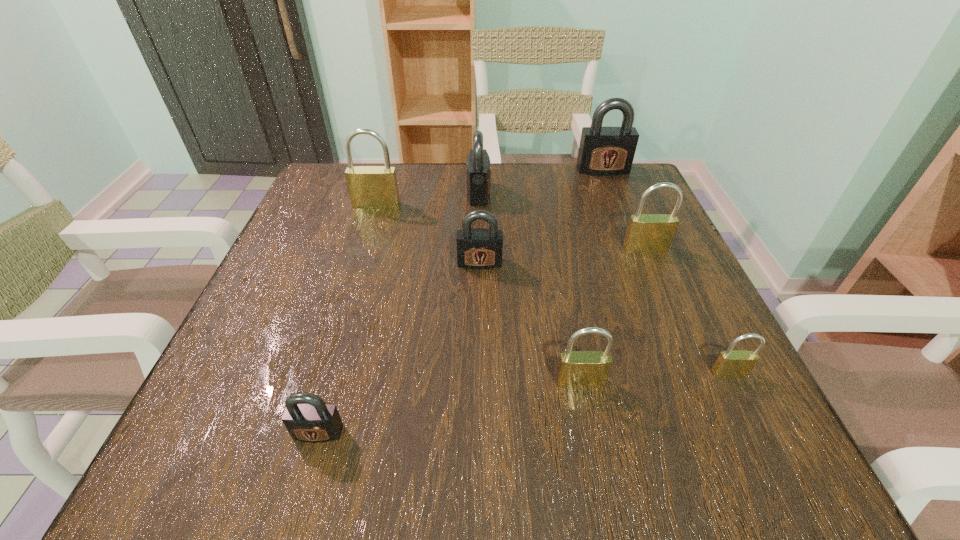
Locate an element on the screen. vacant space that is in between the leftmost brass padlock and the second nearest gray padlock is located at coordinates (428, 234).

Where is `empty location between the fourth padlock from right to left and the second nearest gray padlock`? empty location between the fourth padlock from right to left and the second nearest gray padlock is located at coordinates (530, 322).

The width and height of the screenshot is (960, 540). I want to click on unoccupied position between the biggest gray padlock and the second smallest brass padlock, so click(x=591, y=275).

The width and height of the screenshot is (960, 540). Find the location of `free space between the second nearest gray padlock and the third smallest gray padlock`. free space between the second nearest gray padlock and the third smallest gray padlock is located at coordinates (479, 228).

The width and height of the screenshot is (960, 540). In order to click on free spot between the biggest brass padlock and the third farthest gray padlock in this screenshot , I will do `click(428, 234)`.

Where is `vacant space that is in between the farthest gray padlock and the third farthest gray padlock`? vacant space that is in between the farthest gray padlock and the third farthest gray padlock is located at coordinates (541, 216).

The height and width of the screenshot is (540, 960). I want to click on free space between the fifth padlock from left to right and the second farthest brass padlock, so click(612, 315).

I want to click on free space between the fourth padlock from right to left and the farthest object, so click(591, 275).

Find the location of a particular element. empty space that is in between the second farthest brass padlock and the second brass padlock from left to right is located at coordinates click(612, 315).

Where is `unoccupied position between the farthest gray padlock and the fifth object from left to right`? unoccupied position between the farthest gray padlock and the fifth object from left to right is located at coordinates (591, 275).